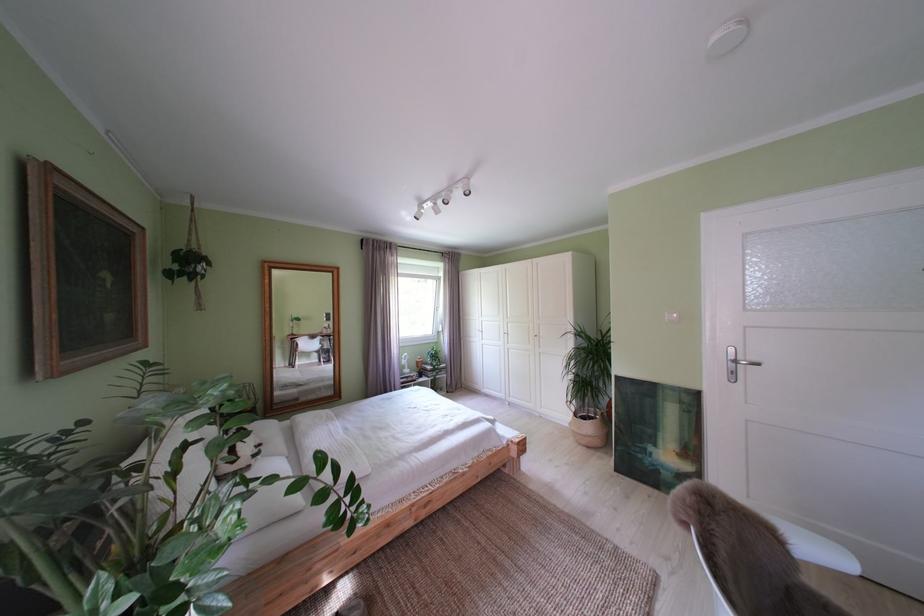
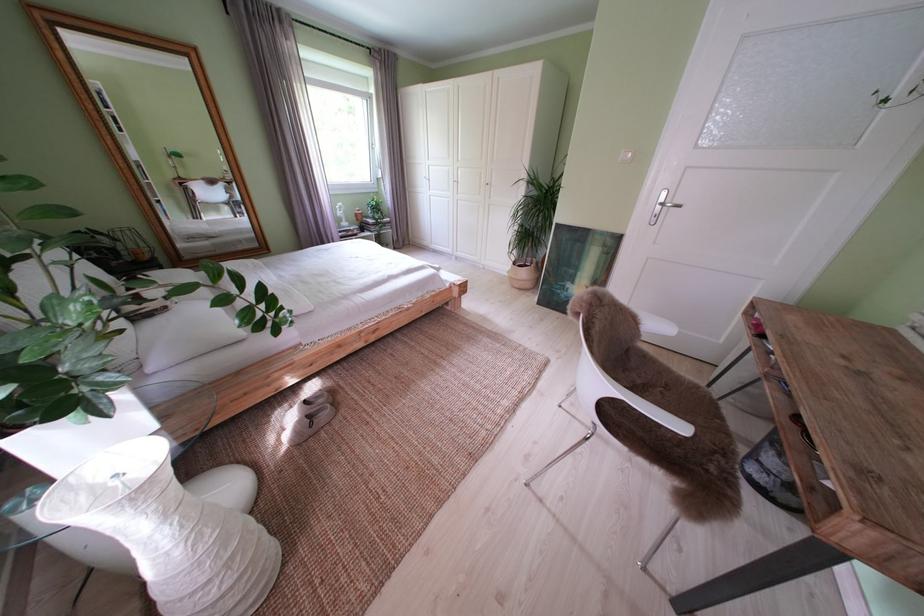
Question: The first image is from the beginning of the video and the second image is from the end. How did the camera likely rotate when shooting the video?

Choices:
 (A) Left
 (B) Right
 (C) Up
 (D) Down

Answer: (D)